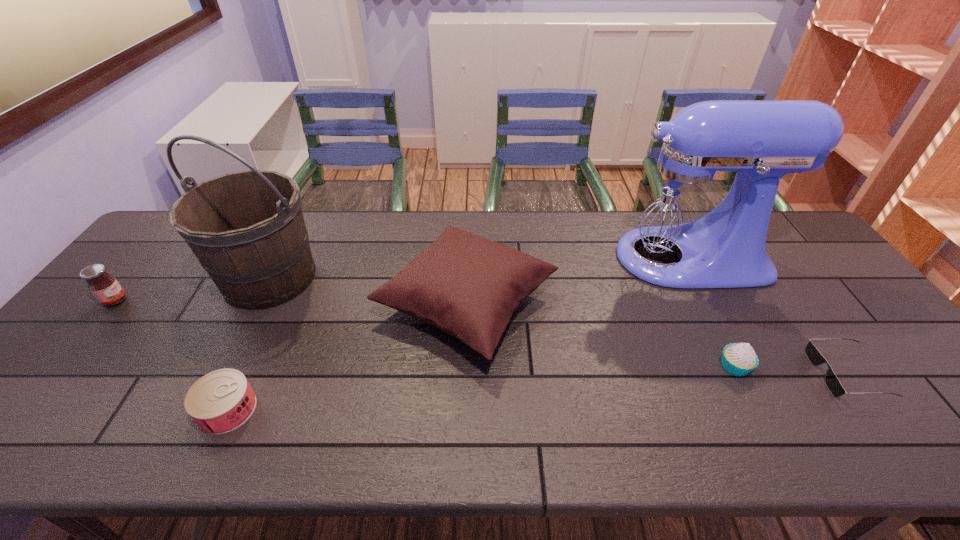
Locate an element on the screen. The width and height of the screenshot is (960, 540). empty location between the bucket and the jam is located at coordinates (192, 289).

You are a GUI agent. You are given a task and a screenshot of the screen. Output one action in this format:
    pyautogui.click(x=<x>, y=<y>)
    Task: Click on the vacant space that is in between the leftmost object and the third shortest object
    The height and width of the screenshot is (540, 960).
    Given the screenshot: What is the action you would take?
    pyautogui.click(x=425, y=334)

Identify the location of vacant area between the second shortest object and the fifth tallest object. The width and height of the screenshot is (960, 540). (481, 388).

This screenshot has width=960, height=540. I want to click on vacant area that lies between the third shortest object and the shortest object, so point(790,370).

Where is `free space between the fifth tallest object and the jam`? free space between the fifth tallest object and the jam is located at coordinates (425, 334).

At what (x,y) coordinates should I click in order to perform the action: click on unoccupied area between the jam and the cushion. Please return your answer as a coordinate pair (x, y). This screenshot has width=960, height=540. Looking at the image, I should click on (291, 302).

Identify which object is the sixth closest to the cupcake. Please provide its 2D coordinates. Your answer should be formatted as a tuple, i.e. [(x, y)], where the tuple contains the x and y coordinates of a point satisfying the conditions above.

[(106, 289)]

Image resolution: width=960 pixels, height=540 pixels. Find the location of `object that stands as the third closest to the mixer`. object that stands as the third closest to the mixer is located at coordinates (739, 359).

Locate an element on the screen. free space that satisfies the following two spatial constraints: 1. on the label side of the second shortest object; 2. on the right side of the leftmost object is located at coordinates (25, 409).

This screenshot has height=540, width=960. Find the location of `vacant point that satisfies the following two spatial constraints: 1. on the label side of the leftmost object; 2. on the back side of the can`. vacant point that satisfies the following two spatial constraints: 1. on the label side of the leftmost object; 2. on the back side of the can is located at coordinates (25, 409).